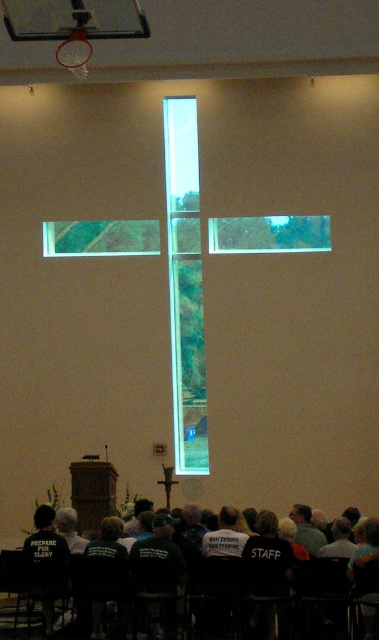
Question: In this image, where is transparent glass window at center located relative to transparent glass cross at upper center?

Choices:
 (A) above
 (B) below

Answer: (A)

Question: Based on their relative distances, which object is farther from the transparent glass window at center?

Choices:
 (A) black fabric shirt at lower center
 (B) clear glass cross at center
 (C) transparent glass cross at upper center

Answer: (A)

Question: Considering the relative positions of black fabric shirt at lower center and transparent glass cross at upper center in the image provided, where is black fabric shirt at lower center located with respect to transparent glass cross at upper center?

Choices:
 (A) right
 (B) left

Answer: (A)

Question: Among these points, which one is farthest from the camera?

Choices:
 (A) (148, 241)
 (B) (275, 230)
 (C) (153, 586)
 (D) (178, 177)

Answer: (D)

Question: Does clear glass cross at center have a smaller size compared to black fabric shirt at lower center?

Choices:
 (A) no
 (B) yes

Answer: (A)

Question: Which point appears farthest from the camera in this image?

Choices:
 (A) (300, 241)
 (B) (125, 552)
 (C) (181, 122)

Answer: (C)